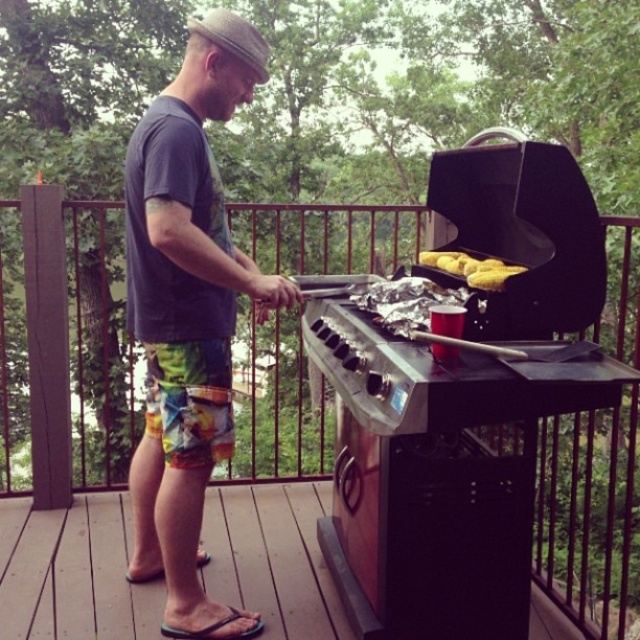
Question: Which point is closer to the camera?

Choices:
 (A) (164, 454)
 (B) (349, 554)
 (C) (195, 348)

Answer: (C)

Question: Which object is farther from the camera taking this photo?

Choices:
 (A) yellow matte corn at center
 (B) wooden deck at lower left
 (C) dark gray t-shirt at center

Answer: (B)

Question: Which object is farther from the camera taking this photo?

Choices:
 (A) dark gray t-shirt at center
 (B) yellow matte corn at center

Answer: (A)

Question: Is dark gray t-shirt at center smaller than wooden deck at lower left?

Choices:
 (A) no
 (B) yes

Answer: (A)

Question: Is black matte barbecue grill at center in front of multicolored printed shorts at lower center?

Choices:
 (A) yes
 (B) no

Answer: (A)

Question: Is black matte barbecue grill at center bigger than dark gray t-shirt at center?

Choices:
 (A) yes
 (B) no

Answer: (A)